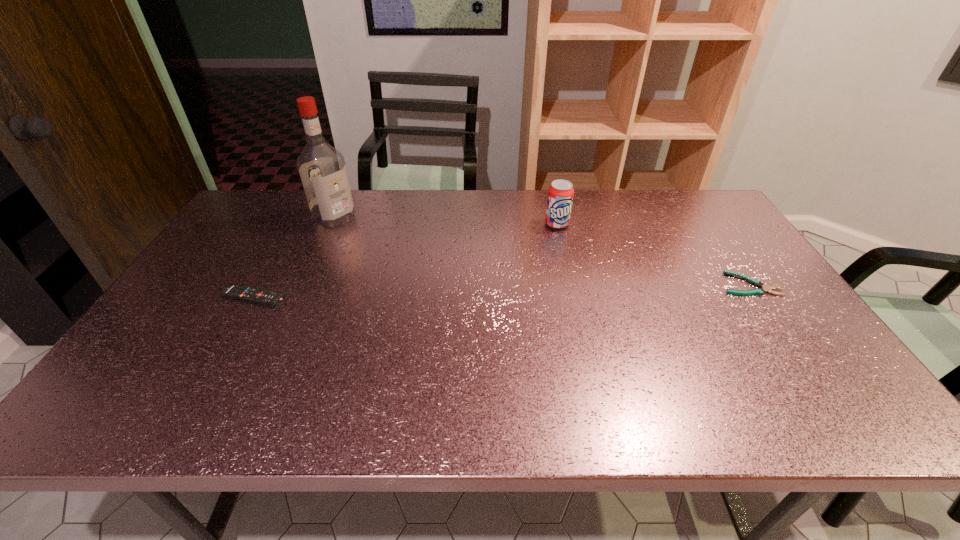
Where is `the third tallest object`? The width and height of the screenshot is (960, 540). the third tallest object is located at coordinates (240, 292).

Find the location of a particular element. The image size is (960, 540). the shortest object is located at coordinates click(x=759, y=291).

Where is `pliers`? The image size is (960, 540). pliers is located at coordinates (759, 291).

Locate an element on the screen. The width and height of the screenshot is (960, 540). soda can is located at coordinates (560, 194).

Where is `the third shortest object`? the third shortest object is located at coordinates (560, 194).

The width and height of the screenshot is (960, 540). What are the coordinates of `liquor` in the screenshot? It's located at (322, 169).

Identify the location of free space located on the back of the third tallest object. Image resolution: width=960 pixels, height=540 pixels. (268, 274).

Where is `free space located 0.050m on the left of the pliers`? The height and width of the screenshot is (540, 960). free space located 0.050m on the left of the pliers is located at coordinates (703, 284).

This screenshot has height=540, width=960. Identify the location of vacant space situated 0.220m on the surface of the third object from left to right. (568, 275).

You are a GUI agent. You are given a task and a screenshot of the screen. Output one action in this format:
    pyautogui.click(x=<x>, y=<y>)
    Task: Click on the vacant space located 0.260m on the surface of the third object from left to right
    
    Given the screenshot: What is the action you would take?
    pyautogui.click(x=570, y=285)